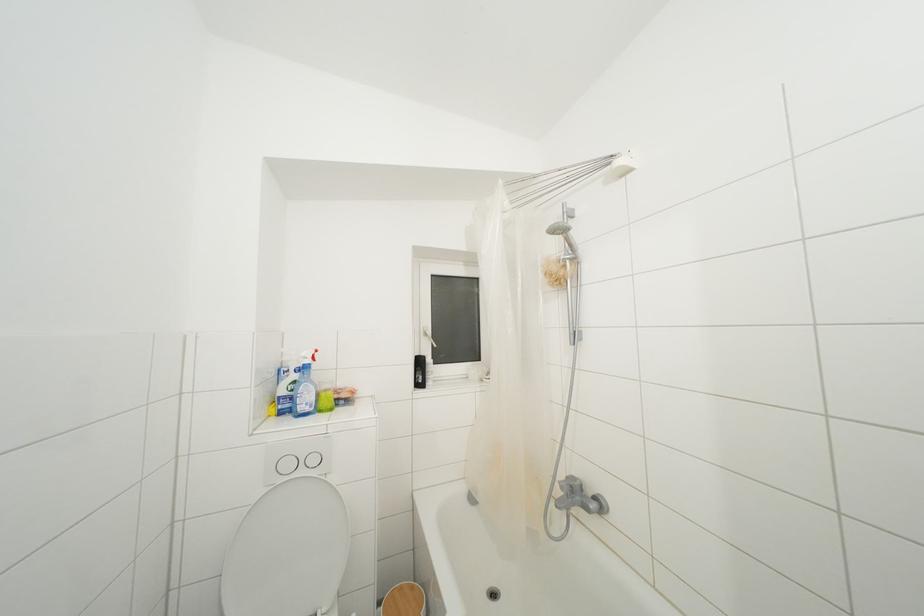
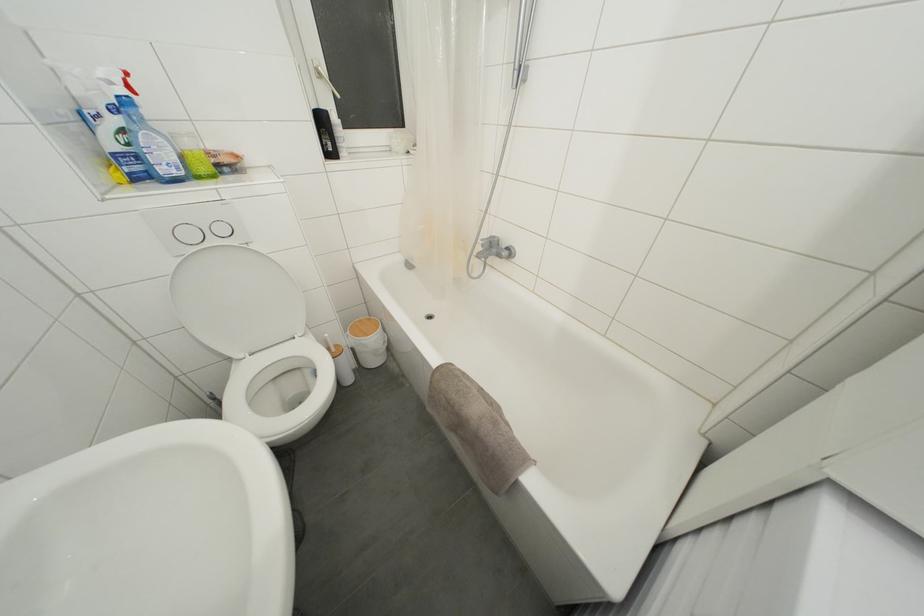
Where in the second image is the point corresponding to (565,480) from the first image?

(488, 240)